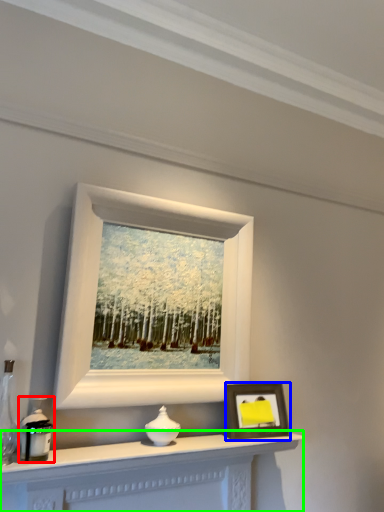
Question: Which is farther away from candle holder (highlighted by a red box)? picture frame (highlighted by a blue box) or table (highlighted by a green box)?

Choices:
 (A) picture frame
 (B) table

Answer: (A)